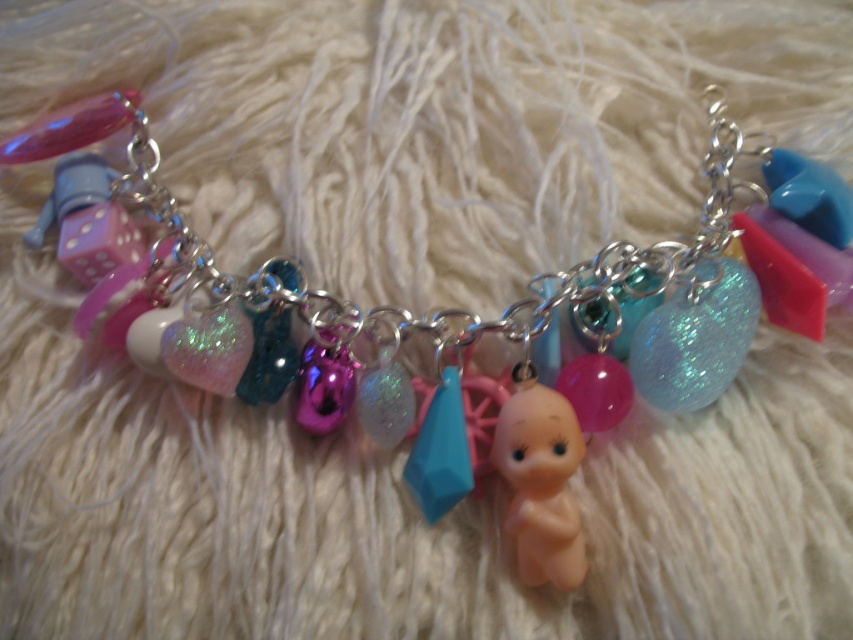
Where is the glittery blue sphere at center located in the image?

The glittery blue sphere at center is located at point (695,337).

You are a jeweler examining the charm bracelet. You need to determine which charm is wider between the glittery blue sphere at center and the pink matte dice at center. Which one is wider?

The pink matte dice at center is wider than the glittery blue sphere at center.